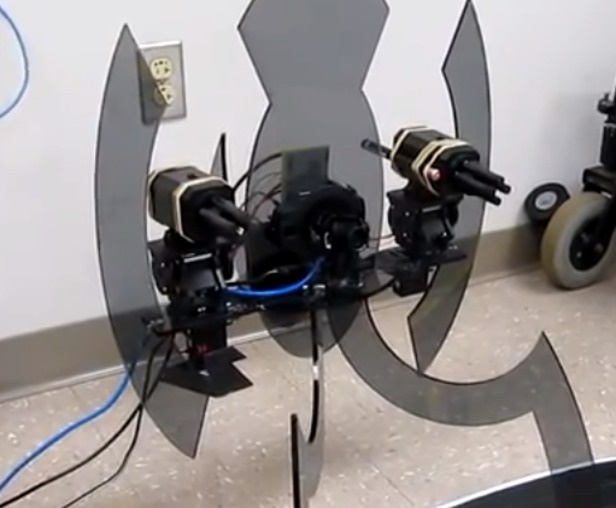
Locate an element on the screen. wall is located at coordinates (184, 16).